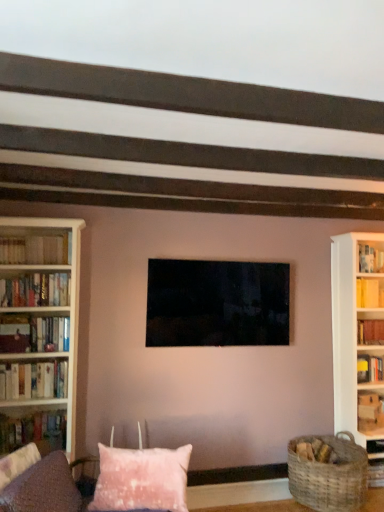
The width and height of the screenshot is (384, 512). Describe the element at coordinates (329, 476) in the screenshot. I see `woven brown basket at lower right` at that location.

Measure the distance between point (294, 445) and camera.

Point (294, 445) and camera are 11.50 feet apart.

Find the location of a particular element. wooden bookshelf at right, the sixth book in the left-to-right sequence is located at coordinates (370, 332).

Find the location of a particular element. Image resolution: width=384 pixels, height=512 pixels. pink fluffy pillow at lower center is located at coordinates (142, 479).

Identify the location of pink fabric couch at lower center. (44, 488).

How far apart are wooden bookshelf at right, which is the third book from bottom to top, and hardcover books at left, the 5th book when ordered from right to left?

They are 8.80 feet apart.

From a real-world perspective, is wooden bookshelf at right, the fourth book positioned from the top, above or below hardcover books at left, placed as the second book when sorted from left to right?

wooden bookshelf at right, the fourth book positioned from the top, is situated lower than hardcover books at left, placed as the second book when sorted from left to right, in the real world.

Between point (374, 324) and point (20, 242), which one is positioned in front?

The point (20, 242) is in front.

Is hardcover books at left, placed as the first book when sorted from top to bottom, at the back of wooden bookshelf at right, which is the third book from bottom to top?

No, wooden bookshelf at right, which is the third book from bottom to top, is not facing away from hardcover books at left, placed as the first book when sorted from top to bottom.

Consider the image. From a real-world perspective, does hardcover book at left, placed as the fourth book when sorted from left to right, stand above woven brown basket at lower right?

Yes, from a real-world perspective, hardcover book at left, placed as the fourth book when sorted from left to right, is on top of woven brown basket at lower right.

Is point (53, 418) closer to viewer compared to point (350, 497)?

That is False.

Would you say hardcover book at left, which is the 1th book from bottom to top, contains woven brown basket at lower right?

That's incorrect, woven brown basket at lower right is not inside hardcover book at left, which is the 1th book from bottom to top.

Is there a large distance between hardcover book at left, placed as the fourth book when sorted from left to right, and woven brown basket at lower right?

Indeed, hardcover book at left, placed as the fourth book when sorted from left to right, is not near woven brown basket at lower right.

Relative to hardcover books at left, placed as the second book when sorted from left to right, is hardcover book at left, which appears as the 3th book when viewed from the right, in front or behind?

Visually, hardcover book at left, which appears as the 3th book when viewed from the right, is located in front of hardcover books at left, placed as the second book when sorted from left to right.

From a real-world perspective, is hardcover book at left, which appears as the 3th book when viewed from the right, on top of hardcover books at left, placed as the second book when sorted from left to right?

No, from a real-world perspective, hardcover book at left, which appears as the 3th book when viewed from the right, is not on top of hardcover books at left, placed as the second book when sorted from left to right.

Would you say hardcover books at left, placed as the first book when sorted from top to bottom, is part of hardcover book at left, placed as the fourth book when sorted from left to right,'s contents?

That's incorrect, hardcover books at left, placed as the first book when sorted from top to bottom, is not inside hardcover book at left, placed as the fourth book when sorted from left to right.

Where is `the 5th book positioned below the hardcover books at left, placed as the second book when sorted from left to right (from a real-world perspective)`? The height and width of the screenshot is (512, 384). the 5th book positioned below the hardcover books at left, placed as the second book when sorted from left to right (from a real-world perspective) is located at coordinates (34, 431).

Is white wooden bookcase at left aimed at matte black tv at center?

No, white wooden bookcase at left is not turned towards matte black tv at center.

Who is bigger, white wooden bookcase at left or matte black tv at center?

With larger size is white wooden bookcase at left.

From a real-world perspective, is white wooden bookcase at left on top of matte black tv at center?

Actually, white wooden bookcase at left is physically below matte black tv at center in the real world.

Considering their positions, is white wooden bookcase at left located in front of or behind matte black tv at center?

Clearly, white wooden bookcase at left is in front of matte black tv at center.

Is hardcover books at left, the second book when ordered from bottom to top, placed right next to woven brown basket at lower right?

No, hardcover books at left, the second book when ordered from bottom to top, is not next to woven brown basket at lower right.

Is hardcover books at left, placed as the 4th book when sorted from right to left, taller than woven brown basket at lower right?

Incorrect, the height of hardcover books at left, placed as the 4th book when sorted from right to left, is not larger of that of woven brown basket at lower right.

Does hardcover books at left, the second book when ordered from bottom to top, have a greater width compared to woven brown basket at lower right?

Incorrect, the width of hardcover books at left, the second book when ordered from bottom to top, does not surpass that of woven brown basket at lower right.

Is hardcover books at left, which is the fifth book from top to bottom, located outside woven brown basket at lower right?

Yes, hardcover books at left, which is the fifth book from top to bottom, is outside of woven brown basket at lower right.

Could you tell me if hardcover books at left, which appears as the 1th book when viewed from the left, is facing matte black tv at center?

No, hardcover books at left, which appears as the 1th book when viewed from the left, is not turned towards matte black tv at center.

Considering the positions of objects hardcover books at left, which appears as the fifth book when ordered from the bottom, and matte black tv at center in the image provided, who is behind, hardcover books at left, which appears as the fifth book when ordered from the bottom, or matte black tv at center?

Positioned behind is matte black tv at center.

From their relative heights in the image, would you say hardcover books at left, which appears as the 1th book when viewed from the left, is taller or shorter than matte black tv at center?

Clearly, hardcover books at left, which appears as the 1th book when viewed from the left, is shorter compared to matte black tv at center.

Can you confirm if wooden bookshelf at right, marked as the 1th book in a right-to-left arrangement, is taller than pink fluffy pillow at lower center?

No.

Does wooden bookshelf at right, marked as the 1th book in a right-to-left arrangement, have a lesser width compared to pink fluffy pillow at lower center?

Yes, wooden bookshelf at right, marked as the 1th book in a right-to-left arrangement, is thinner than pink fluffy pillow at lower center.

Is wooden bookshelf at right, marked as the 1th book in a right-to-left arrangement, far from pink fluffy pillow at lower center?

That's right, there is a large distance between wooden bookshelf at right, marked as the 1th book in a right-to-left arrangement, and pink fluffy pillow at lower center.

From a real-world perspective, starting from the pink fluffy pillow at lower center, which book is the 3rd one vertically above it? Please provide its 2D coordinates.

[(370, 332)]

Find the location of `book that is the 3rd object located below the hardcover books at left, the 6th book in the bottom-to-top sequence (from the image's perspective)`. book that is the 3rd object located below the hardcover books at left, the 6th book in the bottom-to-top sequence (from the image's perspective) is located at coordinates (370, 332).

Where is `the 1st book located above the woven brown basket at lower right (from a real-world perspective)`? the 1st book located above the woven brown basket at lower right (from a real-world perspective) is located at coordinates [x=34, y=431].

Which object lies nearer to the anchor point hardcover book at left, placed as the fourth book when sorted from left to right, white wooden bookcase at left or wooden bookshelf at right, the fourth book positioned from the top?

white wooden bookcase at left.

Looking at the image, which one is located closer to woven brown basket at lower right, hardcover books at left, the 3th book viewed from the left, or wooden bookshelf at right, the fourth book positioned from the top?

wooden bookshelf at right, the fourth book positioned from the top.

Based on their spatial positions, is hardcover books at left, placed as the first book when sorted from top to bottom, or wooden bookshelf at right, the fourth book positioned from the top, further from hardcover books at left, which appears as the fifth book when ordered from the bottom?

Among the two, wooden bookshelf at right, the fourth book positioned from the top, is located further to hardcover books at left, which appears as the fifth book when ordered from the bottom.

When comparing their distances from white wooden bookcase at left, does hardcover book at left, which ranks as the fifth book in left-to-right order, or hardcover books at left, which appears as the fifth book when ordered from the bottom, seem closer?

hardcover book at left, which ranks as the fifth book in left-to-right order, is closer to white wooden bookcase at left.

Based on their spatial positions, is matte black tv at center or hardcover book at left, which appears as the 3th book when viewed from the right, closer to pink fluffy pillow at lower center?

hardcover book at left, which appears as the 3th book when viewed from the right.

When comparing their distances from hardcover books at left, which appears as the 1th book when viewed from the left, does pink fabric couch at lower center or white wooden bookcase at left seem further?

pink fabric couch at lower center.

Which object lies nearer to the anchor point hardcover book at left, which is the 4th book from bottom to top, woven brown basket at lower right or pink fluffy pillow at lower center?

pink fluffy pillow at lower center is closer to hardcover book at left, which is the 4th book from bottom to top.

Based on their spatial positions, is hardcover books at left, the 5th book when ordered from right to left, or hardcover books at left, the second book when ordered from bottom to top, closer to hardcover book at left, which is the 4th book from bottom to top?

hardcover books at left, the second book when ordered from bottom to top, is positioned closer to the anchor hardcover book at left, which is the 4th book from bottom to top.

Image resolution: width=384 pixels, height=512 pixels. Find the location of `book that lies between hardcover books at left, placed as the first book when sorted from top to bottom, and hardcover book at left, which ranks as the fifth book in left-to-right order, from top to bottom`. book that lies between hardcover books at left, placed as the first book when sorted from top to bottom, and hardcover book at left, which ranks as the fifth book in left-to-right order, from top to bottom is located at coordinates (35, 290).

Identify the location of bookcase between hardcover books at left, which appears as the 1th book when viewed from the left, and matte black tv at center from left to right. (39, 332).

Find the location of a particular element. television between hardcover book at left, which is the 1th book from bottom to top, and woven brown basket at lower right, in the horizontal direction is located at coordinates (217, 303).

The image size is (384, 512). Identify the location of couch between white wooden bookcase at left and wooden bookshelf at right, the sixth book in the left-to-right sequence, in the horizontal direction. (44, 488).